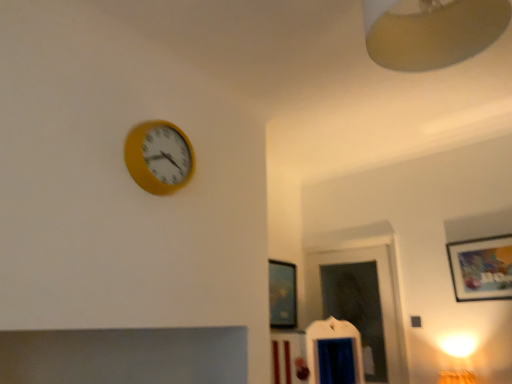
Question: Considering the relative positions of matte wooden picture frame at upper right, the second picture frame when ordered from left to right, and matte beige lampshade at upper right in the image provided, is matte wooden picture frame at upper right, the second picture frame when ordered from left to right, to the right of matte beige lampshade at upper right from the viewer's perspective?

Choices:
 (A) no
 (B) yes

Answer: (B)

Question: From the image's perspective, does matte wooden picture frame at upper right, the 2th picture frame in the back-to-front sequence, appear lower than matte beige lampshade at upper right?

Choices:
 (A) yes
 (B) no

Answer: (A)

Question: Does matte wooden picture frame at upper right, which is counted as the 1th picture frame, starting from the front, have a greater width compared to matte beige lampshade at upper right?

Choices:
 (A) no
 (B) yes

Answer: (A)

Question: Could you tell me if matte wooden picture frame at upper right, the 2th picture frame in the back-to-front sequence, is turned towards matte beige lampshade at upper right?

Choices:
 (A) no
 (B) yes

Answer: (B)

Question: From the image's perspective, is matte wooden picture frame at upper right, the second picture frame when ordered from left to right, over matte beige lampshade at upper right?

Choices:
 (A) no
 (B) yes

Answer: (A)

Question: Could matte beige lampshade at upper right be considered to be inside matte wooden picture frame at upper right, which is counted as the 1th picture frame, starting from the front?

Choices:
 (A) no
 (B) yes

Answer: (A)

Question: Are matte black picture frame at center, which is the first picture frame from back to front, and matte beige lampshade at upper right making contact?

Choices:
 (A) yes
 (B) no

Answer: (B)

Question: From a real-world perspective, is matte black picture frame at center, which appears as the 2th picture frame when viewed from the front, on matte beige lampshade at upper right?

Choices:
 (A) no
 (B) yes

Answer: (A)

Question: Is there a large distance between matte black picture frame at center, marked as the 2th picture frame in a right-to-left arrangement, and matte beige lampshade at upper right?

Choices:
 (A) yes
 (B) no

Answer: (A)

Question: Could matte beige lampshade at upper right be considered to be inside matte black picture frame at center, which appears as the 2th picture frame when viewed from the front?

Choices:
 (A) yes
 (B) no

Answer: (B)

Question: Considering the relative sizes of matte black picture frame at center, which is the first picture frame from back to front, and matte beige lampshade at upper right in the image provided, is matte black picture frame at center, which is the first picture frame from back to front, taller than matte beige lampshade at upper right?

Choices:
 (A) no
 (B) yes

Answer: (B)

Question: Can you confirm if matte black picture frame at center, which appears as the 2th picture frame when viewed from the front, is positioned to the left of matte beige lampshade at upper right?

Choices:
 (A) no
 (B) yes

Answer: (B)

Question: From a real-world perspective, is matte black picture frame at center, which is the first picture frame from back to front, on top of yellow matte clock at upper left?

Choices:
 (A) no
 (B) yes

Answer: (A)